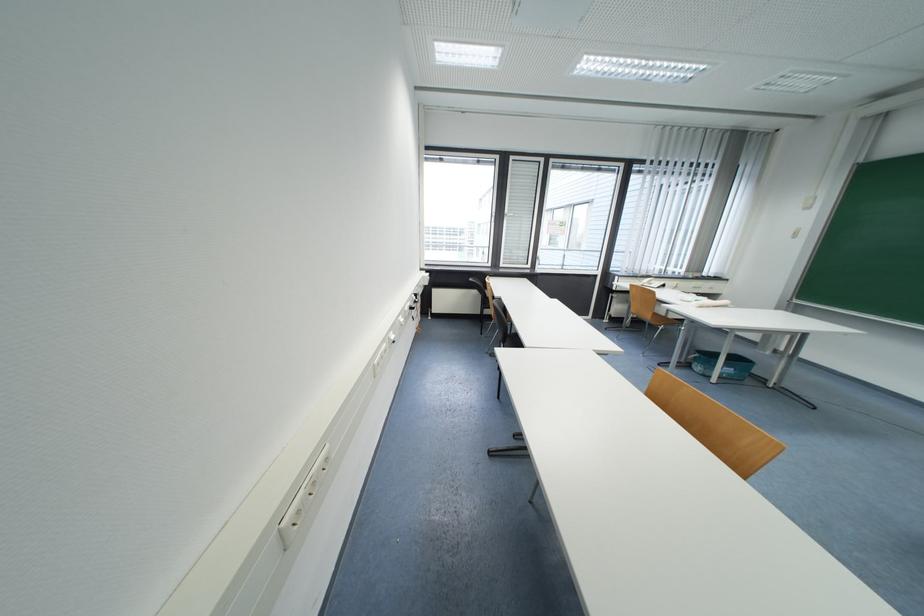
This screenshot has height=616, width=924. Identify the location of white power outlet. (302, 498).